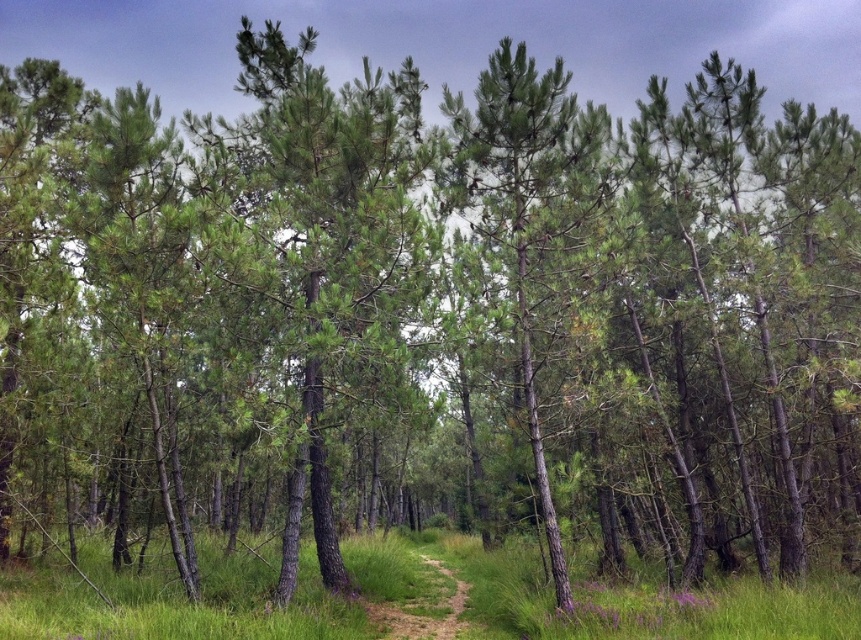
Between green needle-like at center and green textured pine tree at center, which one is positioned lower?

green textured pine tree at center is lower down.

What are the coordinates of `green needle-like at center` in the screenshot? It's located at (332, 259).

Locate an element on the screen. green needle-like at center is located at coordinates (332, 259).

Does green grass at center appear on the left side of green textured pine tree at center?

Indeed, green grass at center is positioned on the left side of green textured pine tree at center.

Who is taller, green grass at center or green textured pine tree at center?

Standing taller between the two is green textured pine tree at center.

Is point (381, 568) positioned after point (562, 160)?

Yes, point (381, 568) is behind point (562, 160).

This screenshot has height=640, width=861. Identify the location of green grass at center. (598, 596).

Is green needle-like at center bigger than green grass at center?

Yes, green needle-like at center is bigger than green grass at center.

Between green needle-like at center and green grass at center, which one appears on the left side from the viewer's perspective?

Positioned to the left is green needle-like at center.

Find the location of a particular element. The image size is (861, 640). green needle-like at center is located at coordinates (332, 259).

Locate an element on the screen. The width and height of the screenshot is (861, 640). green needle-like at center is located at coordinates (332, 259).